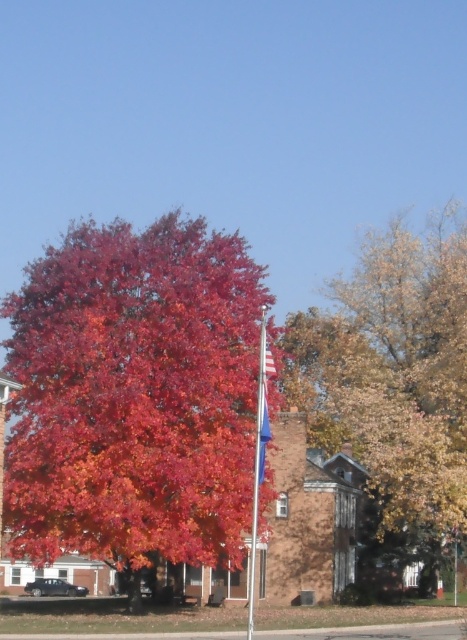
Question: In this image, where is shiny red leaves at center located relative to golden-brown textured tree at center?

Choices:
 (A) below
 (B) above

Answer: (A)

Question: Is shiny red leaves at center to the left of golden-brown textured tree at center from the viewer's perspective?

Choices:
 (A) no
 (B) yes

Answer: (B)

Question: From the image, what is the correct spatial relationship of shiny red leaves at center in relation to golden-brown textured tree at center?

Choices:
 (A) below
 (B) above

Answer: (A)